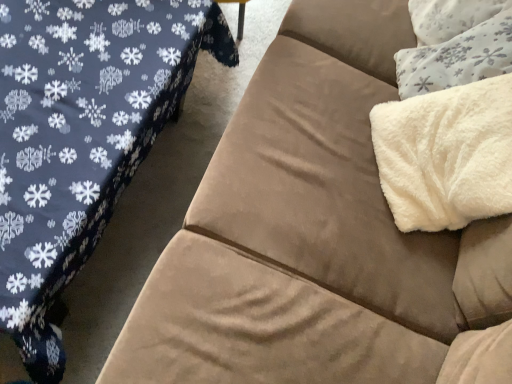
Question: Does point (436, 57) appear closer or farther from the camera than point (479, 178)?

Choices:
 (A) farther
 (B) closer

Answer: (A)

Question: From their relative heights in the image, would you say white fluffy throw pillow at upper right is taller or shorter than white fluffy blanket at upper right?

Choices:
 (A) short
 (B) tall

Answer: (A)

Question: Estimate the real-world distances between objects in this image. Which object is closer to the suede couch at right?

Choices:
 (A) white fluffy throw pillow at upper right
 (B) white fluffy blanket at upper right

Answer: (B)

Question: Estimate the real-world distances between objects in this image. Which object is closer to the white fluffy throw pillow at upper right?

Choices:
 (A) suede couch at right
 (B) white fluffy blanket at upper right

Answer: (B)